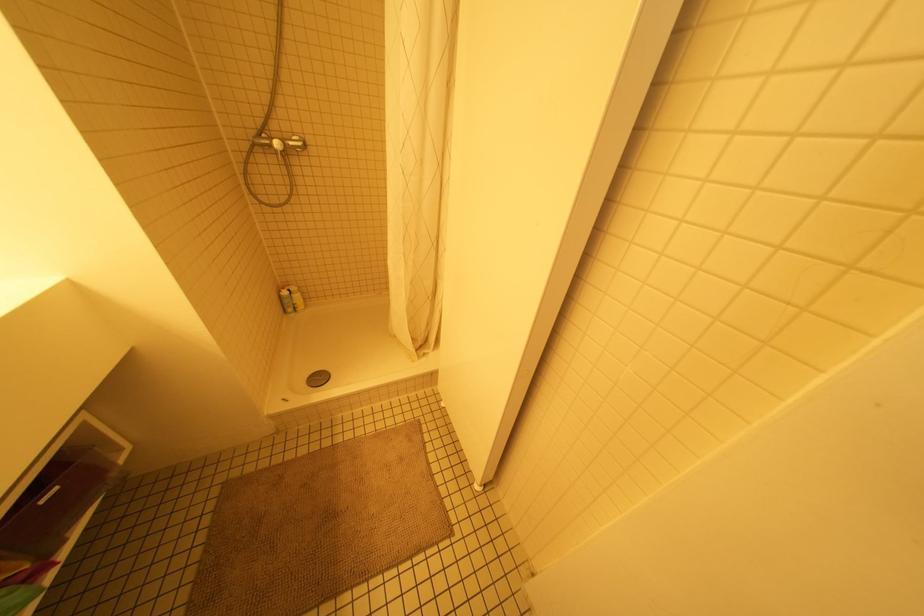
Describe the element at coordinates (318, 378) in the screenshot. I see `the round drain cover` at that location.